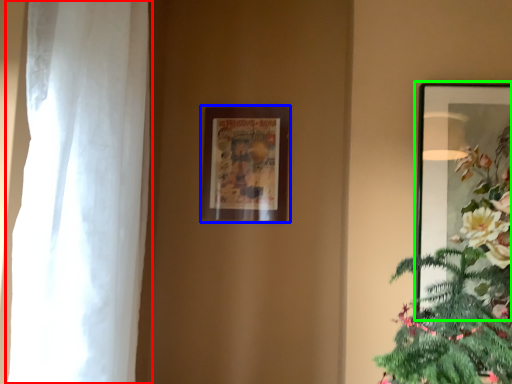
Question: Based on their relative distances, which object is farther from curtain (highlighted by a red box)? Choose from picture frame (highlighted by a blue box) and picture frame (highlighted by a green box).

Choices:
 (A) picture frame
 (B) picture frame

Answer: (B)